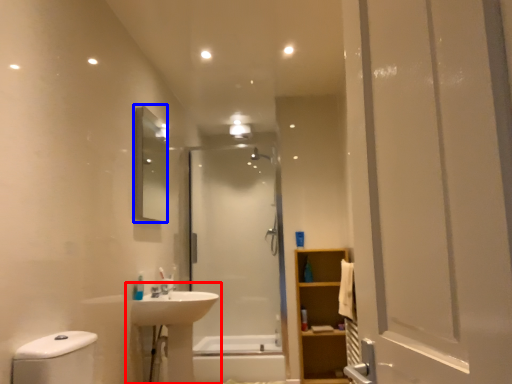
Question: Which object is further to the camera taking this photo, sink (highlighted by a red box) or mirror (highlighted by a blue box)?

Choices:
 (A) sink
 (B) mirror

Answer: (B)